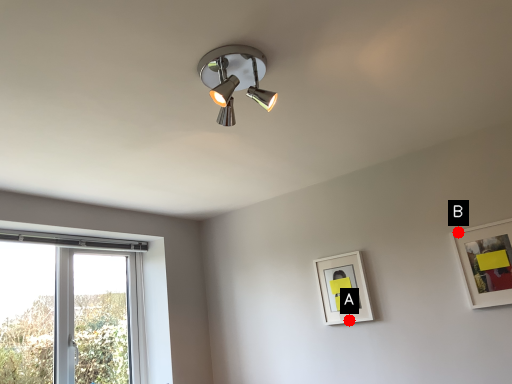
Question: Two points are circled on the image, labeled by A and B beside each circle. Which point appears farthest from the camera in this image?

Choices:
 (A) A is further
 (B) B is further

Answer: (A)